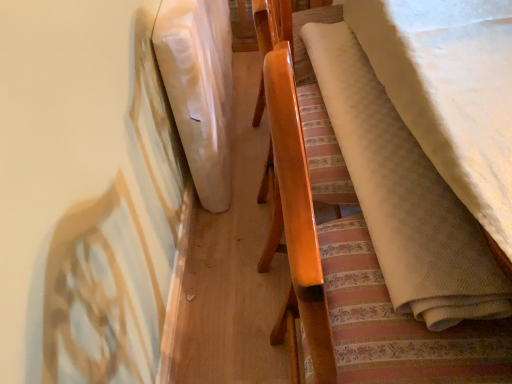
Question: Considering the positions of point (218, 193) and point (282, 228), is point (218, 193) closer or farther from the camera than point (282, 228)?

Choices:
 (A) closer
 (B) farther

Answer: (B)

Question: From the image's perspective, is white fabric at upper left located above or below matte wood chair at center?

Choices:
 (A) above
 (B) below

Answer: (A)

Question: From a real-world perspective, relative to matte wood chair at center, is white fabric at upper left vertically above or below?

Choices:
 (A) below
 (B) above

Answer: (A)

Question: From a real-world perspective, relative to white fabric at upper left, is matte wood chair at center vertically above or below?

Choices:
 (A) below
 (B) above

Answer: (B)

Question: Based on their positions, is matte wood chair at center located to the left or right of white fabric at upper left?

Choices:
 (A) right
 (B) left

Answer: (A)

Question: Is matte wood chair at center in front of or behind white fabric at upper left in the image?

Choices:
 (A) behind
 (B) front

Answer: (B)

Question: From their relative heights in the image, would you say matte wood chair at center is taller or shorter than white fabric at upper left?

Choices:
 (A) tall
 (B) short

Answer: (A)